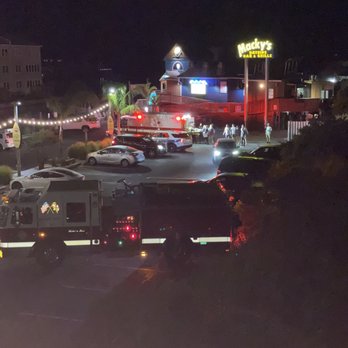
This screenshot has height=348, width=348. What are the coordinates of `restaurant` in the screenshot? It's located at (215, 92).